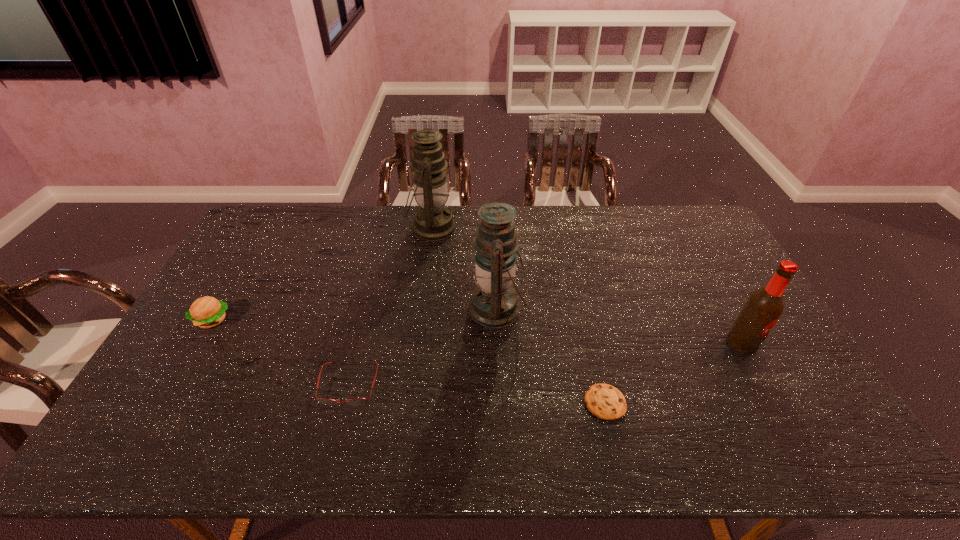
I want to click on free location at the near edge, so click(x=727, y=450).

Where is `vacant space at the left edge of the desktop`? vacant space at the left edge of the desktop is located at coordinates (264, 251).

In the image, there is a desktop. Identify the location of vacant area at the right edge. The width and height of the screenshot is (960, 540). (769, 421).

Image resolution: width=960 pixels, height=540 pixels. In the image, there is a desktop. Find the location of `free space at the near left corner`. free space at the near left corner is located at coordinates (115, 447).

What are the coordinates of `vacant space at the far right corner of the desktop` in the screenshot? It's located at (696, 212).

Image resolution: width=960 pixels, height=540 pixels. I want to click on vacant point located between the rightmost object and the shortest object, so click(x=673, y=373).

The width and height of the screenshot is (960, 540). What are the coordinates of `free space that is in between the rightmost object and the spectacles` in the screenshot? It's located at (545, 364).

The image size is (960, 540). What are the coordinates of `free space between the hamburger and the fourth object from left to right` in the screenshot? It's located at (355, 314).

You are a GUI agent. You are given a task and a screenshot of the screen. Output one action in this format:
    pyautogui.click(x=<x>, y=<y>)
    Task: Click on the empty space that is in between the farthest object and the right oil lamp
    The image size is (960, 540).
    Given the screenshot: What is the action you would take?
    pyautogui.click(x=465, y=268)

At what (x,y) coordinates should I click in order to perform the action: click on free spot between the shortest object and the fourth shortest object. Please return your answer as a coordinate pair (x, y). This screenshot has height=540, width=960. Looking at the image, I should click on (673, 373).